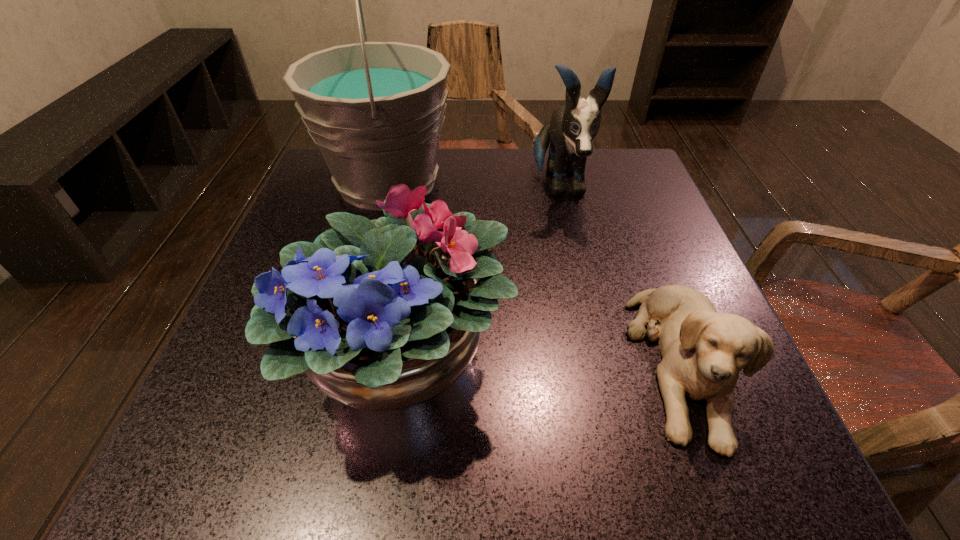
This screenshot has width=960, height=540. What are the coordinates of `the second closest object to the bouquet` in the screenshot? It's located at (703, 351).

Where is `free space that satisfies the following two spatial constraints: 1. on the front side of the bouquet; 2. on the right side of the tallest object`? free space that satisfies the following two spatial constraints: 1. on the front side of the bouquet; 2. on the right side of the tallest object is located at coordinates (342, 355).